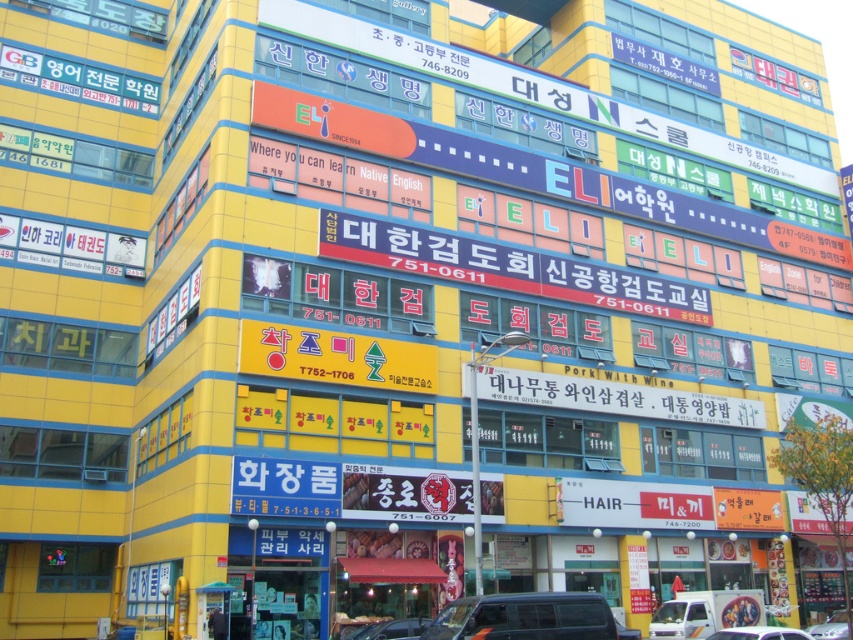
You are a delivery driver who needs to park your shiny silver car at center in a tight space. There is a dark gray metallic van at center blocking your path. Can you maneuver around it to park?

The dark gray metallic van at center is in front of your shiny silver car at center, so you can maneuver around it by moving to the sides since it is blocking your path directly.

You are a delivery driver who needs to park your vehicle between two other vehicles in the image. You have a dark gray metallic van at center and a shiny silver car at center. Which one should you park to the left of?

You should park to the left of the shiny silver car at center because the dark gray metallic van at center is already positioned on its left side.